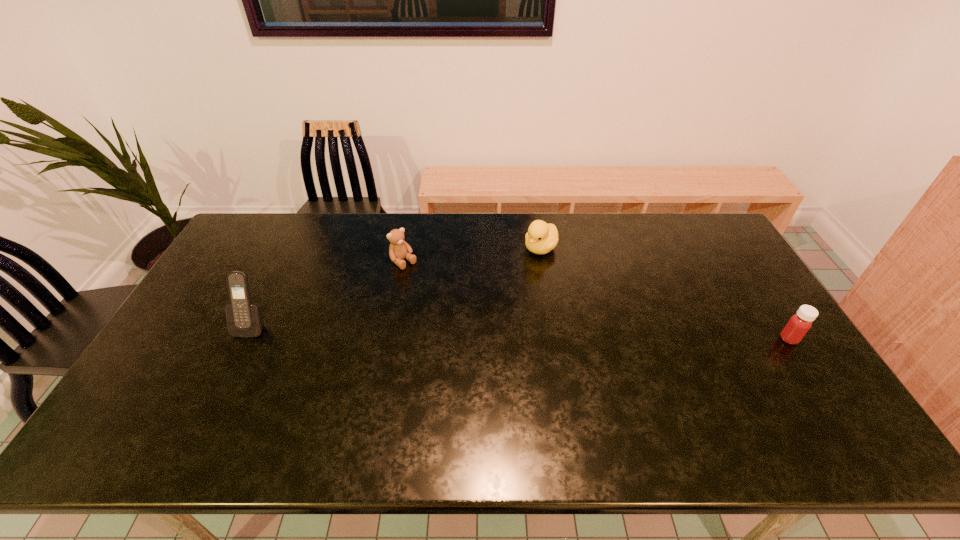
You are a GUI agent. You are given a task and a screenshot of the screen. Output one action in this format:
    pyautogui.click(x=<x>, y=<y>)
    Task: Click on the tallest object
    Image resolution: width=960 pixels, height=540 pixels.
    Given the screenshot: What is the action you would take?
    pyautogui.click(x=243, y=319)

Identify the location of cellular telephone. The image size is (960, 540). (243, 319).

This screenshot has height=540, width=960. I want to click on the rightmost object, so click(x=799, y=324).

In order to click on the second object from right to left in this screenshot , I will do (541, 238).

You are a GUI agent. You are given a task and a screenshot of the screen. Output one action in this format:
    pyautogui.click(x=<x>, y=<y>)
    Task: Click on the second object from left to right
    This screenshot has width=960, height=540.
    Given the screenshot: What is the action you would take?
    pyautogui.click(x=398, y=250)

Where is `vacant area situated on the front-facing side of the tallest object`? The width and height of the screenshot is (960, 540). vacant area situated on the front-facing side of the tallest object is located at coordinates (238, 352).

The width and height of the screenshot is (960, 540). I want to click on free spot located on the left of the medicine, so click(x=758, y=339).

Locate an element on the screen. The image size is (960, 540). vacant space located 0.380m on the front-facing side of the second object from right to left is located at coordinates (465, 325).

Find the location of `blank space located on the front-facing side of the second object from right to left`. blank space located on the front-facing side of the second object from right to left is located at coordinates (525, 265).

Where is `vacant space located 0.190m on the front-facing side of the second object from right to left`? This screenshot has width=960, height=540. vacant space located 0.190m on the front-facing side of the second object from right to left is located at coordinates (501, 288).